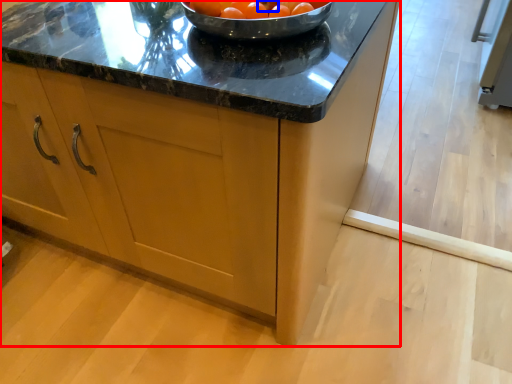
Question: Which object is further to the camera taking this photo, cabinetry (highlighted by a red box) or tomato (highlighted by a blue box)?

Choices:
 (A) cabinetry
 (B) tomato

Answer: (B)